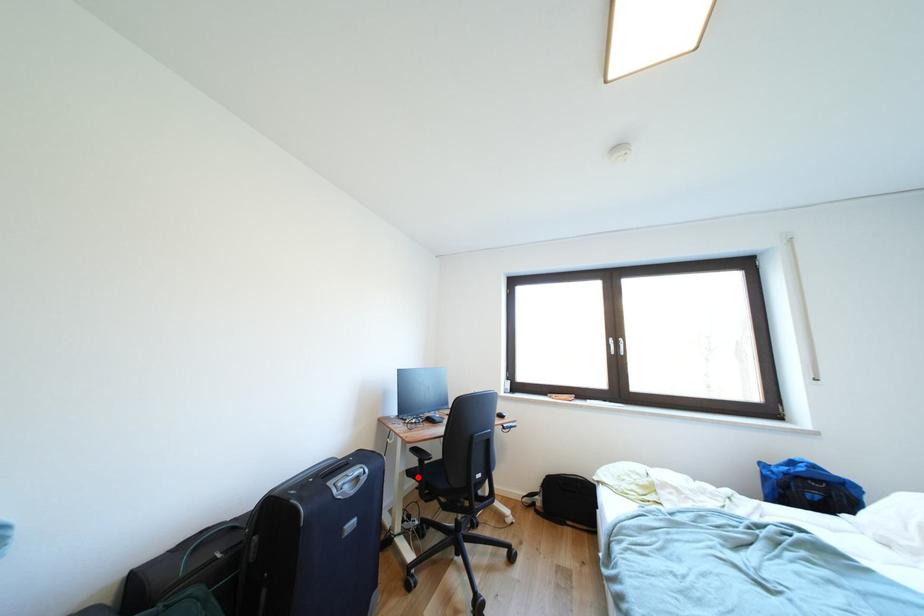
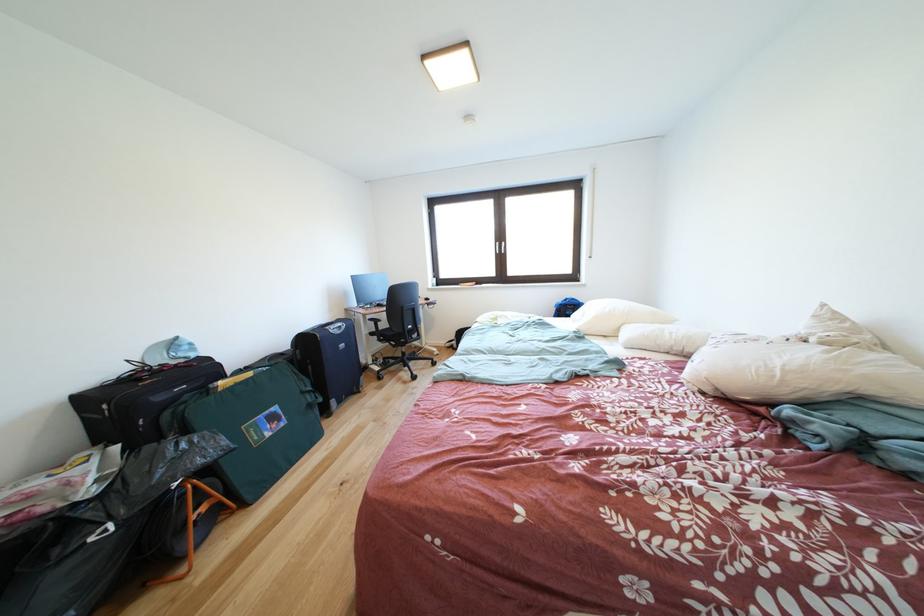
Question: I am providing you with two images of the same scene from different viewpoints. Image1 has a red point marked. In image2, the corresponding 3D location appears at what relative position? Reply with the corresponding letter.

Choices:
 (A) Closer
 (B) Farther

Answer: (A)